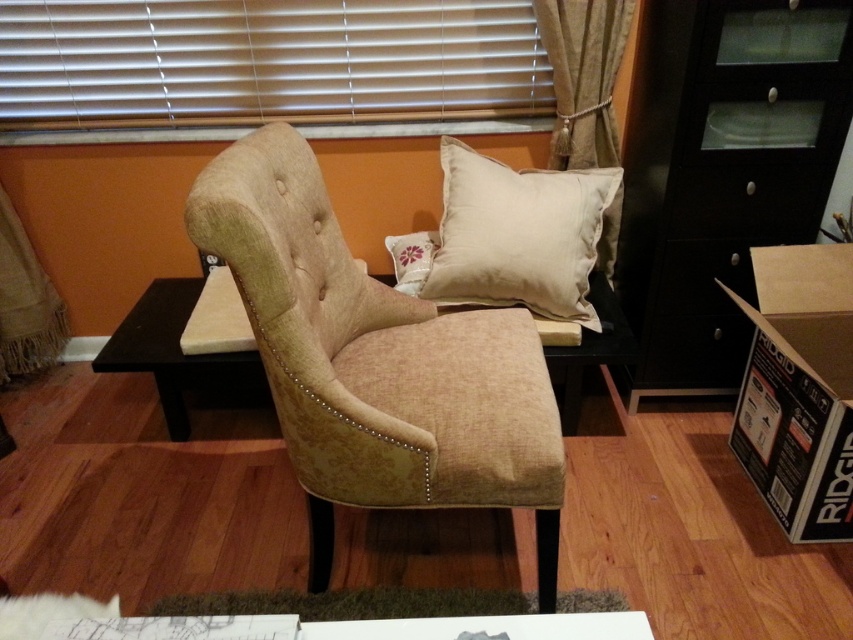
You are standing in the room and want to determine which of the two points, point (450, 291) or point (49, 364), is closer to you. Based on the scene description, which point is nearer?

Point (450, 291) is closer to the camera than point (49, 364).

You are standing in the room and want to reach the matte black drawer at right without moving your feet. Can you comfortably extend your arm to touch it?

The matte black drawer at right is 5.27 feet away from the viewer. Since the average human arm length is about 2.5 feet, you cannot comfortably reach it without moving your feet.

You are sitting in the armchair and want to reach both the beige fabric pillow at upper center and the burlap curtain at lower left. Which object is easier to grab without moving your current position?

The beige fabric pillow at upper center is easier to grab because it is closer to the viewer than the burlap curtain at lower left.